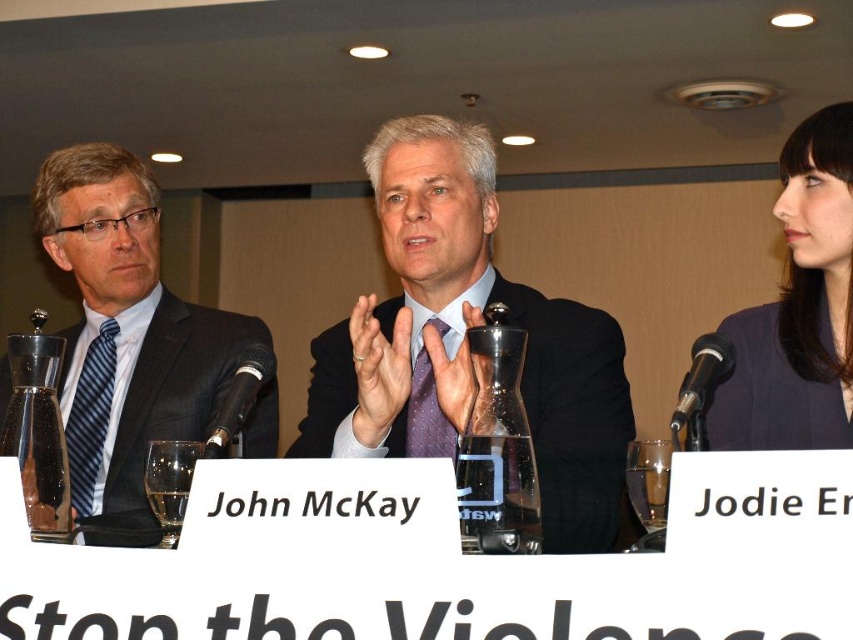
You are a photographer standing behind the matte black suit at center and the matte black suit at left. You need to capture a photo of both individuals without any obstructions. Given that your camera has a minimum focus distance of 18 inches, will you be able to take the photo successfully?

The matte black suit at center is 17.99 inches away from the matte black suit at left. Since the distance between them is slightly less than the camera minimum focus distance of 18 inches, you won not be able to take the photo successfully without obstructions.

You are a photographer at the event and need to capture a clear shot of the black plastic microphone at center without the dark blue fabric at right blocking the view. Is it possible to position yourself in a way that the microphone is visible without the fabric obstructing it?

The black plastic microphone at center is behind the dark blue fabric at right, so positioning yourself in a way to see the microphone without the fabric blocking it would require moving around to a position where the microphone is in front of the fabric. However, since the microphone is already behind the fabric, it might not be possible unless there is an angle where the fabric isn t between you and the microphone.

What is the color of the suit at the point labeled as point (465, 342)?

The point (465, 342) is on matte black suit at center, so the color is matte black.